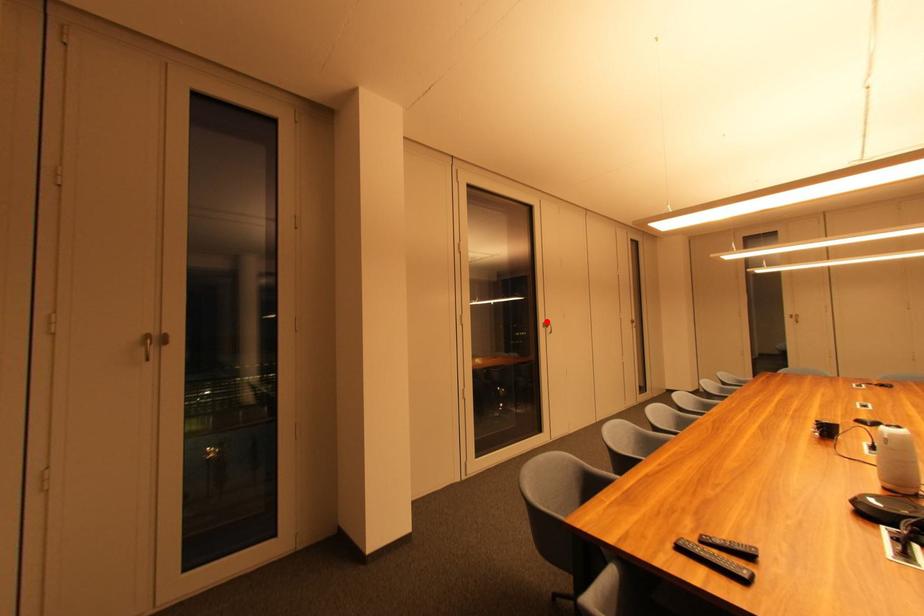
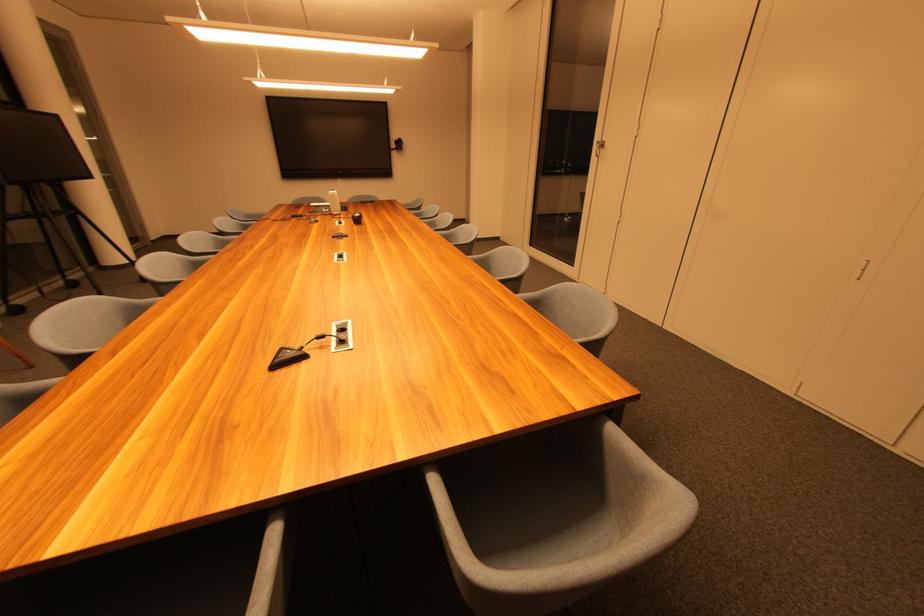
Find the pixel in the second image that matches the highlighted location in the first image.

(602, 140)